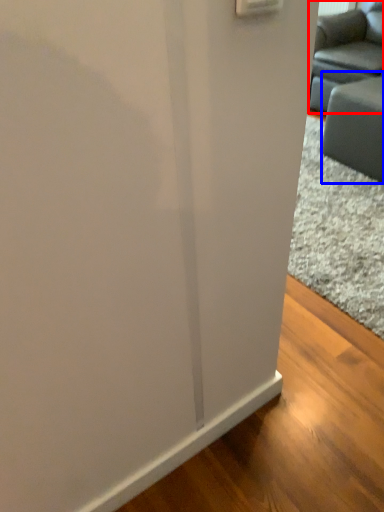
Question: Which object appears closest to the camera in this image, studio couch (highlighted by a red box) or furniture (highlighted by a blue box)?

Choices:
 (A) studio couch
 (B) furniture

Answer: (B)